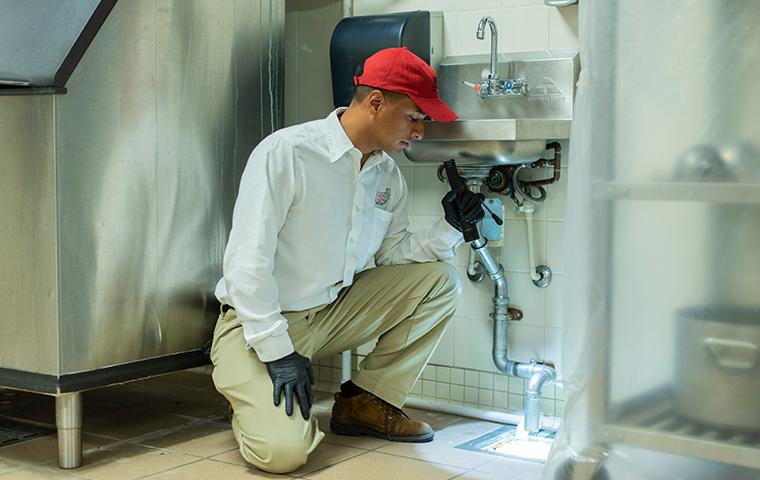
Image resolution: width=760 pixels, height=480 pixels. In order to click on metal pot in this screenshot , I will do `click(711, 369)`.